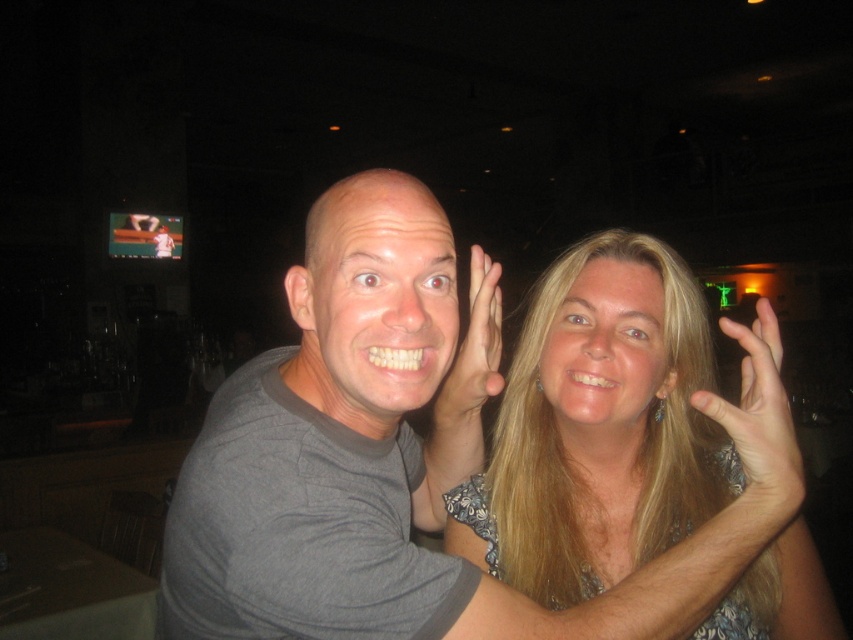
Question: Is gray fabric couple at center to the right of smooth skin hand at upper right from the viewer's perspective?

Choices:
 (A) no
 (B) yes

Answer: (A)

Question: Where is blonde hair at center located in relation to matte skin hand at center in the image?

Choices:
 (A) right
 (B) left

Answer: (A)

Question: Can you confirm if smooth skin hand at upper right is smaller than matte skin hand at center?

Choices:
 (A) no
 (B) yes

Answer: (A)

Question: Which of these objects is positioned closest to the smooth skin hand at upper right?

Choices:
 (A) matte skin hand at center
 (B) blonde hair at center
 (C) gray fabric couple at center

Answer: (B)

Question: Which of the following is the closest to the observer?

Choices:
 (A) blonde hair at center
 (B) gray fabric couple at center
 (C) smooth skin hand at upper right
 (D) matte skin hand at center

Answer: (B)

Question: Which object is farther from the camera taking this photo?

Choices:
 (A) matte skin hand at center
 (B) blonde hair at center

Answer: (A)